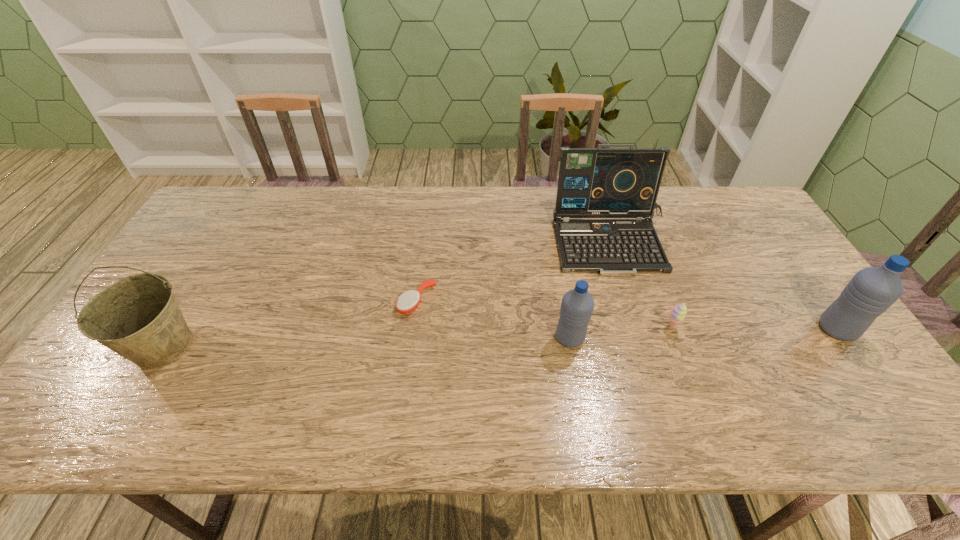
This screenshot has height=540, width=960. In order to click on vacant area that lies between the left water bottle and the taller water bottle in this screenshot , I will do `click(704, 334)`.

What are the coordinates of `free space between the hairbrush and the laptop computer` in the screenshot? It's located at (515, 272).

Find the location of `blank region between the laptop computer and the rightmost object`. blank region between the laptop computer and the rightmost object is located at coordinates (725, 286).

In order to click on free space between the second shortest object and the fourth tallest object in this screenshot , I will do `click(621, 332)`.

This screenshot has height=540, width=960. I want to click on vacant area between the farthest object and the shorter water bottle, so click(591, 290).

The image size is (960, 540). Find the location of `object that is the fifth nearest to the second object from left to right`. object that is the fifth nearest to the second object from left to right is located at coordinates (872, 290).

Where is `object that ranks as the third closest to the farthest object`? Image resolution: width=960 pixels, height=540 pixels. object that ranks as the third closest to the farthest object is located at coordinates point(872,290).

You are a GUI agent. You are given a task and a screenshot of the screen. Output one action in this format:
    pyautogui.click(x=<x>, y=<y>)
    Task: Click on the vacant point that satisfies the following two spatial constraints: 1. on the front-facing side of the fifth tallest object; 2. on the right side of the laptop computer
    The width and height of the screenshot is (960, 540).
    Given the screenshot: What is the action you would take?
    pyautogui.click(x=638, y=327)

I want to click on blank space that satisfies the following two spatial constraints: 1. on the back side of the fourth tallest object; 2. on the right side of the sherbert, so click(x=568, y=327).

Image resolution: width=960 pixels, height=540 pixels. I want to click on free space that satisfies the following two spatial constraints: 1. on the back side of the right water bottle; 2. on the right side of the wine bucket, so click(x=174, y=329).